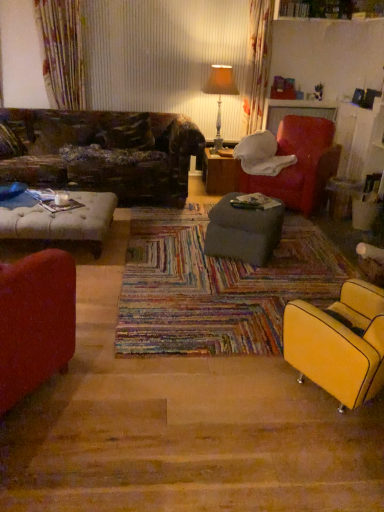
Question: Does matte red armchair at upper right, the 1th chair from the top, have a greater width compared to leather-like brown pillow at upper left?

Choices:
 (A) no
 (B) yes

Answer: (B)

Question: Is matte red armchair at upper right, the 1th chair from the top, oriented away from leather-like brown pillow at upper left?

Choices:
 (A) yes
 (B) no

Answer: (B)

Question: Is matte red armchair at upper right, which is the 2th chair in bottom-to-top order, taller than leather-like brown pillow at upper left?

Choices:
 (A) yes
 (B) no

Answer: (A)

Question: Is matte red armchair at upper right, the 1th chair from the top, far from leather-like brown pillow at upper left?

Choices:
 (A) yes
 (B) no

Answer: (A)

Question: Does matte red armchair at upper right, the 2th chair from the front, touch leather-like brown pillow at upper left?

Choices:
 (A) no
 (B) yes

Answer: (A)

Question: From a real-world perspective, is matte red armchair at upper right, the 2th chair from the front, beneath leather-like brown pillow at upper left?

Choices:
 (A) yes
 (B) no

Answer: (A)

Question: From a real-world perspective, is matte yellow armchair at lower right, which is the second chair from back to front, located beneath wooden table at center, which is counted as the second table, starting from the front?

Choices:
 (A) yes
 (B) no

Answer: (B)

Question: Are matte yellow armchair at lower right, which appears as the second chair when viewed from the top, and wooden table at center, the 1th table from the top, located far from each other?

Choices:
 (A) no
 (B) yes

Answer: (B)

Question: Is matte yellow armchair at lower right, which is the second chair from back to front, directly adjacent to wooden table at center, the 1th table from the top?

Choices:
 (A) yes
 (B) no

Answer: (B)

Question: Does matte yellow armchair at lower right, which ranks as the first chair in front-to-back order, have a greater width compared to wooden table at center, the 1th table from the top?

Choices:
 (A) yes
 (B) no

Answer: (B)

Question: Is matte yellow armchair at lower right, which ranks as the first chair in front-to-back order, oriented towards wooden table at center, the 1th table from the top?

Choices:
 (A) yes
 (B) no

Answer: (B)

Question: From the image's perspective, is matte yellow armchair at lower right, the 1th chair positioned from the bottom, on wooden table at center, which is counted as the second table, starting from the front?

Choices:
 (A) yes
 (B) no

Answer: (B)

Question: Does orange fabric lampshade at upper center appear on the left side of wooden table at center, the 1th table from the top?

Choices:
 (A) no
 (B) yes

Answer: (B)